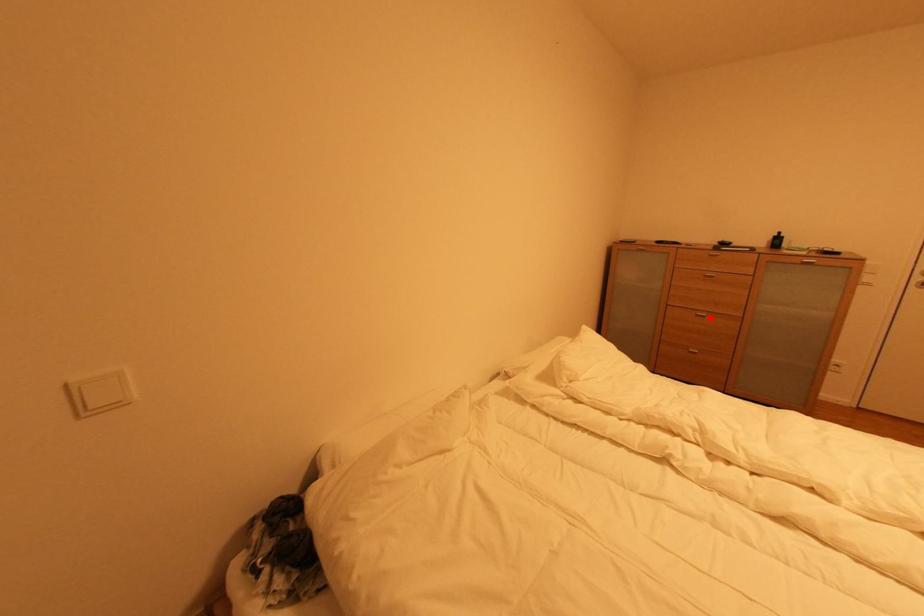
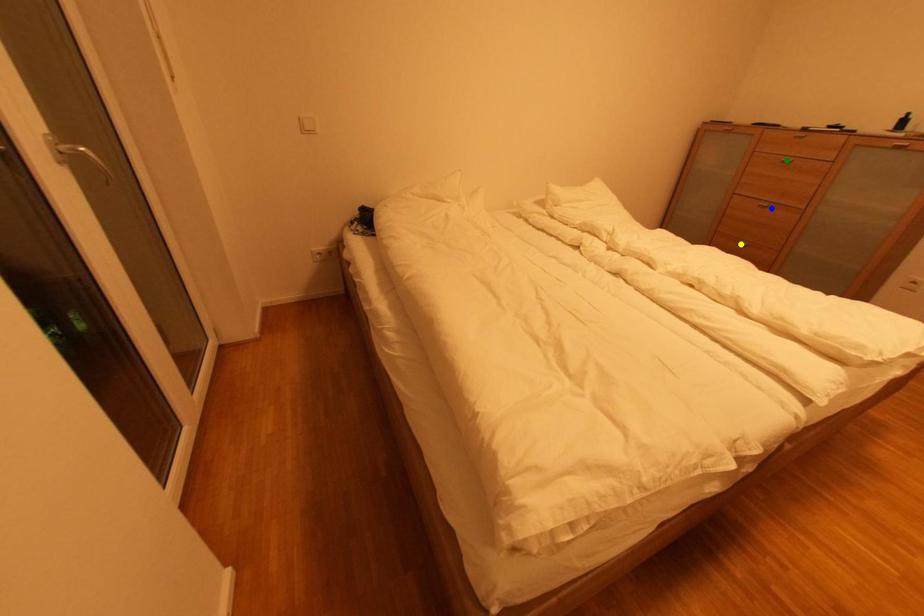
Question: I am providing you with two images of the same scene from different viewpoints. A red point is marked on the first image. You are given multiple points on the second image. Can you choose the point in image 2 that corresponds to the point in image 1?

Choices:
 (A) blue point
 (B) green point
 (C) yellow point

Answer: (A)